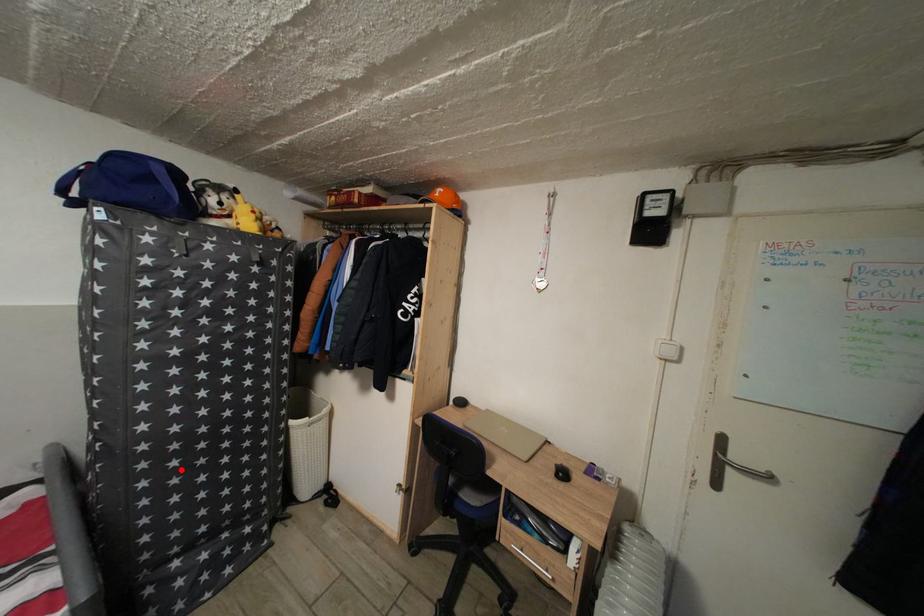
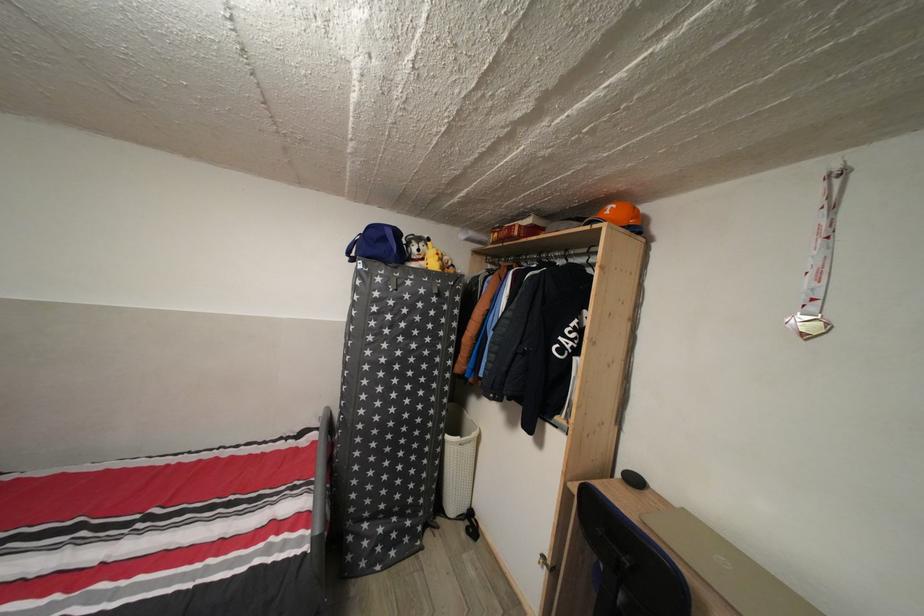
Question: I am providing you with two images of the same scene from different viewpoints. A red point is shown in image1. For the corresponding object point in image2, is it positioned nearer or farther from the camera?

Choices:
 (A) Nearer
 (B) Farther

Answer: (B)